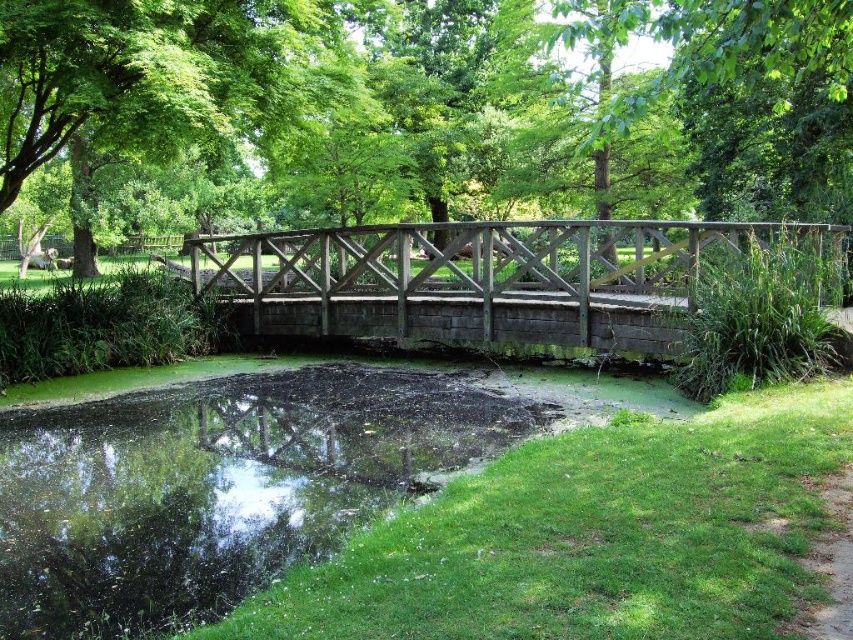
Question: Does green algae water at bottom left appear over wooden bridge at center?

Choices:
 (A) yes
 (B) no

Answer: (B)

Question: Which object is positioned farthest from the green wood bridge at center?

Choices:
 (A) wooden bridge at center
 (B) green algae water at bottom left

Answer: (B)

Question: Which object appears farthest from the camera in this image?

Choices:
 (A) green wood bridge at center
 (B) wooden bridge at center

Answer: (B)

Question: Can you confirm if green wood bridge at center is positioned below green algae water at bottom left?

Choices:
 (A) yes
 (B) no

Answer: (B)

Question: Among these objects, which one is farthest from the camera?

Choices:
 (A) green algae water at bottom left
 (B) wooden bridge at center

Answer: (B)

Question: Does green wood bridge at center lie behind green algae water at bottom left?

Choices:
 (A) yes
 (B) no

Answer: (B)